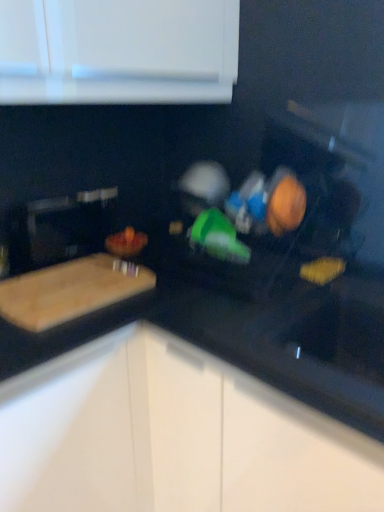
Question: Considering their positions, is yellow matte sponge at lower right, placed as the 2th food when sorted from back to front, located in front of or behind black glossy countertop at center?

Choices:
 (A) front
 (B) behind

Answer: (B)

Question: From a real-world perspective, is yellow matte sponge at lower right, which is the second food in front-to-back order, above or below black glossy countertop at center?

Choices:
 (A) above
 (B) below

Answer: (A)

Question: Which of these objects is positioned farthest from the yellow matte sponge at lower right, which is the second food in front-to-back order?

Choices:
 (A) orange matte bowl at center, the first food when ordered from back to front
 (B) wooden bowl at center, placed as the 1th food when sorted from front to back
 (C) natural wood cutting board at left
 (D) black glossy countertop at center

Answer: (A)

Question: Estimate the real-world distances between objects in this image. Which object is farther from the yellow matte sponge at lower right, placed as the 2th food when sorted from back to front?

Choices:
 (A) orange matte bowl at center, the first food when ordered from back to front
 (B) wooden bowl at center, the second food positioned from the right
 (C) black glossy countertop at center
 (D) natural wood cutting board at left

Answer: (A)